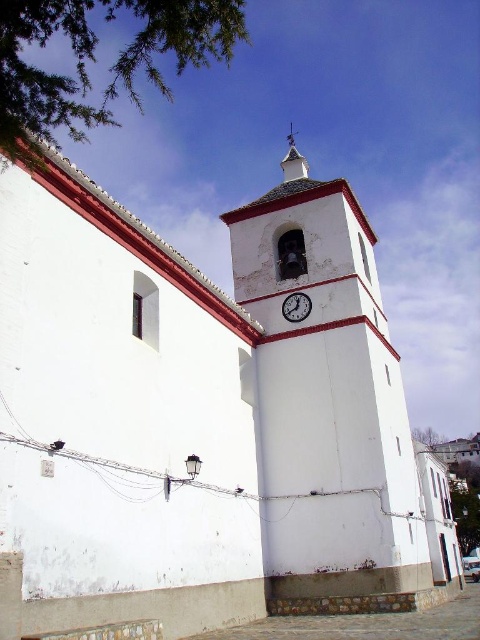
Does white wood spire at upper center have a larger size compared to white glossy clock at upper center?

Yes, white wood spire at upper center is bigger than white glossy clock at upper center.

Which is behind, point (289, 129) or point (303, 300)?

The point (289, 129) is behind.

Is point (292, 161) positioned in front of point (289, 310)?

That is False.

Find the location of a particular element. The height and width of the screenshot is (640, 480). white wood spire at upper center is located at coordinates (292, 161).

Based on the photo, is white painted brick clock tower at center above white glossy clock at upper center?

Incorrect, white painted brick clock tower at center is not positioned above white glossy clock at upper center.

Does white painted brick clock tower at center appear under white glossy clock at upper center?

Correct, white painted brick clock tower at center is located below white glossy clock at upper center.

Which is in front, point (406, 531) or point (301, 307)?

Positioned in front is point (406, 531).

The height and width of the screenshot is (640, 480). I want to click on white painted brick clock tower at center, so click(x=326, y=403).

At what (x,y) coordinates should I click in order to perform the action: click on white painted brick clock tower at center. Please return your answer as a coordinate pair (x, y). Looking at the image, I should click on (326, 403).

Does white painted brick clock tower at center appear under white wood spire at upper center?

Yes.

Is point (369, 225) farther from camera compared to point (280, 163)?

No, (369, 225) is in front of (280, 163).

This screenshot has height=640, width=480. In order to click on white painted brick clock tower at center in this screenshot , I will do `click(326, 403)`.